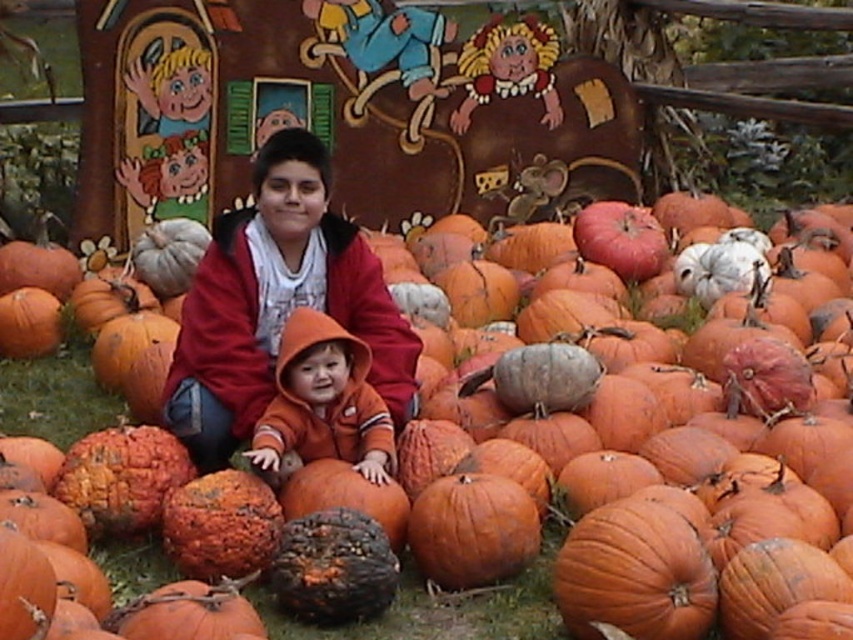
In the autumn scene, there is an orange matte pumpkin at center and an orange fleece hoodie at center. Which one is located more to the left?

The orange matte pumpkin at center is positioned more to the left than the orange fleece hoodie at center.

You are a photographer trying to capture both the matte red hoodie at center and the orange matte pumpkin at center in a single frame. Which object should you focus on first if you want to ensure both are in clear focus?

The matte red hoodie at center is bigger than the orange matte pumpkin at center, so focusing on the matte red hoodie at center first will help ensure both are in focus since it requires a closer focus distance.

You are trying to decide whether to place a small decorative item on the orange fleece hoodie at center or the orange matte pumpkin at center. Based on their sizes, which surface would be more stable for the item?

The orange matte pumpkin at center has a larger width than the orange fleece hoodie at center, so placing the small decorative item on the orange matte pumpkin at center would provide a more stable surface.